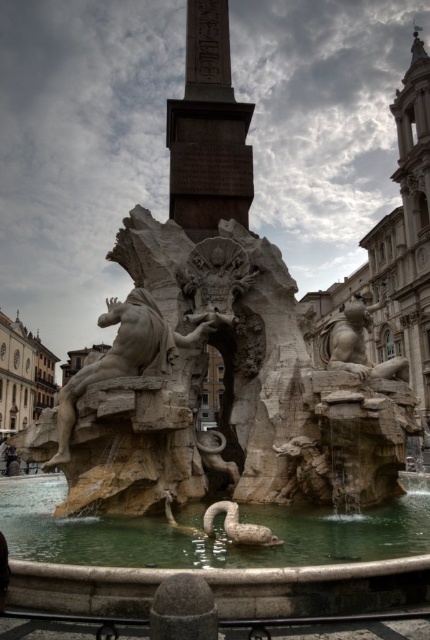
Question: Is green stone water at center positioned at the back of stone statue at center?

Choices:
 (A) yes
 (B) no

Answer: (B)

Question: Which point is farther to the camera?

Choices:
 (A) (399, 374)
 (B) (33, 490)
 (C) (108, 301)

Answer: (B)

Question: Is stone statue at center smaller than smooth stone lion at right?

Choices:
 (A) yes
 (B) no

Answer: (A)

Question: Which object is positioned closest to the stone statue at center?

Choices:
 (A) green stone water at center
 (B) smooth stone lion at right

Answer: (A)

Question: Is stone statue at center positioned behind smooth stone lion at right?

Choices:
 (A) yes
 (B) no

Answer: (B)

Question: Which point is closer to the camera?

Choices:
 (A) (353, 316)
 (B) (169, 340)
 (C) (64, 536)

Answer: (C)